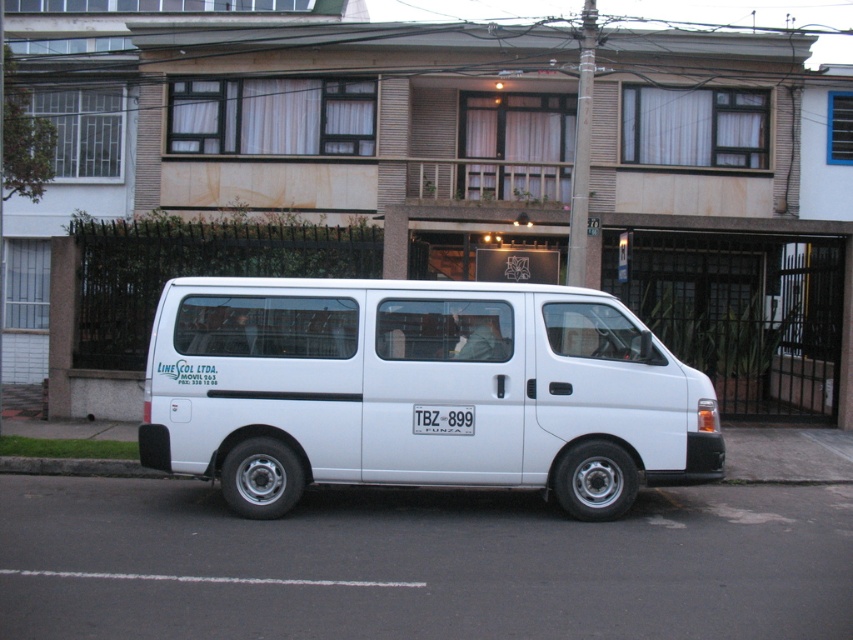
Question: Does white matte van at center have a larger size compared to white plastic license plate at center?

Choices:
 (A) no
 (B) yes

Answer: (B)

Question: Is white matte van at center wider than white plastic license plate at center?

Choices:
 (A) no
 (B) yes

Answer: (B)

Question: Does white matte van at center have a smaller size compared to white plastic license plate at center?

Choices:
 (A) no
 (B) yes

Answer: (A)

Question: Which of the following is the closest to the observer?

Choices:
 (A) (434, 422)
 (B) (224, 451)

Answer: (A)

Question: Among these points, which one is farthest from the camera?

Choices:
 (A) (440, 429)
 (B) (496, 449)

Answer: (B)